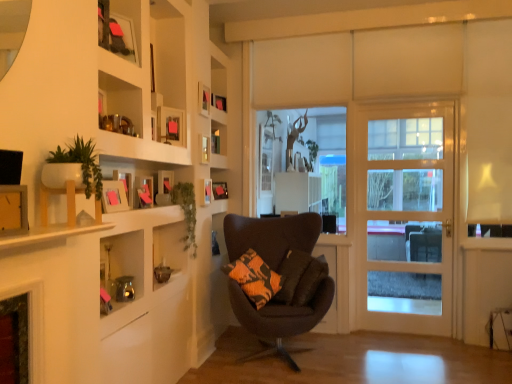
You are a GUI agent. You are given a task and a screenshot of the screen. Output one action in this format:
    pyautogui.click(x=<x>, y=<y>)
    Task: Click on the dark brown leather swivel chair at center
    
    Given the screenshot: What is the action you would take?
    pyautogui.click(x=423, y=242)

What do you see at coordinates (13, 210) in the screenshot? Image resolution: width=512 pixels, height=384 pixels. I see `matte gold picture frame at left, marked as the eighth picture frame in a back-to-front arrangement` at bounding box center [13, 210].

Measure the distance between matte wooden picture frame at upper center, which appears as the 4th picture frame when viewed from the back, and camera.

matte wooden picture frame at upper center, which appears as the 4th picture frame when viewed from the back, and camera are 3.25 meters apart.

What do you see at coordinates (204, 99) in the screenshot?
I see `matte wooden picture frame at upper center, which appears as the 4th picture frame when viewed from the back` at bounding box center [204, 99].

Measure the distance between matte wooden picture frame at upper center, acting as the 3th picture frame starting from the front, and camera.

2.88 meters.

What is the approximate height of matte black picture frame at upper center, placed as the 7th picture frame when sorted from front to back?

It is 5.47 inches.

What do you see at coordinates (114, 196) in the screenshot? The width and height of the screenshot is (512, 384). I see `matte pink picture frame at upper left, which is the seventh picture frame in back-to-front order` at bounding box center [114, 196].

The width and height of the screenshot is (512, 384). What do you see at coordinates (281, 319) in the screenshot?
I see `dark brown fabric chair at center` at bounding box center [281, 319].

I want to click on dark brown leather swivel chair at center, so click(x=423, y=242).

Is matte gold picture frame at left, which is the first picture frame from front to back, placed right next to dark brown leather swivel chair at center?

No, matte gold picture frame at left, which is the first picture frame from front to back, is not touching dark brown leather swivel chair at center.

Considering the sizes of objects matte gold picture frame at left, marked as the eighth picture frame in a back-to-front arrangement, and dark brown leather swivel chair at center in the image provided, who is thinner, matte gold picture frame at left, marked as the eighth picture frame in a back-to-front arrangement, or dark brown leather swivel chair at center?

With smaller width is matte gold picture frame at left, marked as the eighth picture frame in a back-to-front arrangement.

In terms of size, does matte gold picture frame at left, marked as the eighth picture frame in a back-to-front arrangement, appear bigger or smaller than dark brown leather swivel chair at center?

Clearly, matte gold picture frame at left, marked as the eighth picture frame in a back-to-front arrangement, is smaller in size than dark brown leather swivel chair at center.

Is matte gold picture frame at left, which is the first picture frame from front to back, behind dark brown leather swivel chair at center?

No.

How distant is matte black picture frame at upper center, marked as the 1th picture frame in a back-to-front arrangement, from orange-patterned fabric pillow at center?

matte black picture frame at upper center, marked as the 1th picture frame in a back-to-front arrangement, and orange-patterned fabric pillow at center are 1.08 meters apart.

Is matte black picture frame at upper center, marked as the 1th picture frame in a back-to-front arrangement, oriented towards orange-patterned fabric pillow at center?

No, matte black picture frame at upper center, marked as the 1th picture frame in a back-to-front arrangement, is not facing towards orange-patterned fabric pillow at center.

Is matte black picture frame at upper center, the 8th picture frame in the front-to-back sequence, next to orange-patterned fabric pillow at center?

No, matte black picture frame at upper center, the 8th picture frame in the front-to-back sequence, is not touching orange-patterned fabric pillow at center.

Does point (224, 190) appear closer or farther from the camera than point (285, 277)?

Point (224, 190) appears to be farther away from the viewer than point (285, 277).

Which point is more distant from viewer, (395, 274) or (263, 328)?

Point (395, 274)

In terms of size, does light wood door at right appear bigger or smaller than dark brown fabric chair at center?

light wood door at right is smaller than dark brown fabric chair at center.

Can you confirm if light wood door at right is shorter than dark brown fabric chair at center?

No.

From the picture: Choose the correct answer: Is light wood door at right inside dark brown fabric chair at center or outside it?

light wood door at right is not enclosed by dark brown fabric chair at center.

Would you say matte wooden picture frame at upper center, the 6th picture frame viewed from the back, is outside dark brown fabric chair at center?

Indeed, matte wooden picture frame at upper center, the 6th picture frame viewed from the back, is completely outside dark brown fabric chair at center.

In the image, is matte wooden picture frame at upper center, acting as the 3th picture frame starting from the front, positioned in front of or behind dark brown fabric chair at center?

In the image, matte wooden picture frame at upper center, acting as the 3th picture frame starting from the front, appears in front of dark brown fabric chair at center.

From a real-world perspective, which is physically below, matte wooden picture frame at upper center, acting as the 3th picture frame starting from the front, or dark brown fabric chair at center?

In real-world perspective, dark brown fabric chair at center is lower.

Can you tell me how much matte wooden picture frame at upper center, acting as the 3th picture frame starting from the front, and dark brown fabric chair at center differ in facing direction?

There is a 44-degree angle between the facing directions of matte wooden picture frame at upper center, acting as the 3th picture frame starting from the front, and dark brown fabric chair at center.

Measure the distance from matte pink picture frame at upper left, which is the seventh picture frame in back-to-front order, to matte wooden picture frame at upper center, which ranks as the 4th picture frame in front-to-back order.

matte pink picture frame at upper left, which is the seventh picture frame in back-to-front order, and matte wooden picture frame at upper center, which ranks as the 4th picture frame in front-to-back order, are 19.96 inches apart from each other.

Who is more distant, matte pink picture frame at upper left, arranged as the second picture frame when viewed from the front, or matte wooden picture frame at upper center, which ranks as the 4th picture frame in front-to-back order?

matte wooden picture frame at upper center, which ranks as the 4th picture frame in front-to-back order, is behind.

Could you tell me if matte pink picture frame at upper left, arranged as the second picture frame when viewed from the front, is turned towards matte wooden picture frame at upper center, placed as the fifth picture frame when sorted from back to front?

No, matte pink picture frame at upper left, arranged as the second picture frame when viewed from the front, is not oriented towards matte wooden picture frame at upper center, placed as the fifth picture frame when sorted from back to front.

Can matte wooden picture frame at upper center, which ranks as the 4th picture frame in front-to-back order, be found inside matte pink picture frame at upper left, which is the seventh picture frame in back-to-front order?

No, matte wooden picture frame at upper center, which ranks as the 4th picture frame in front-to-back order, is not surrounded by matte pink picture frame at upper left, which is the seventh picture frame in back-to-front order.

Between green leafy plant at upper left and wooden shelves at upper left, which one has larger width?

With larger width is wooden shelves at upper left.

Can you tell me how much green leafy plant at upper left and wooden shelves at upper left differ in facing direction?

0.383 degrees separate the facing orientations of green leafy plant at upper left and wooden shelves at upper left.

Could you tell me if green leafy plant at upper left is turned towards wooden shelves at upper left?

No, green leafy plant at upper left is not oriented towards wooden shelves at upper left.

Considering their positions, is wooden shelves at upper left located in front of or behind dark brown leather swivel chair at center?

Visually, wooden shelves at upper left is located in front of dark brown leather swivel chair at center.

From the image's perspective, who appears lower, wooden shelves at upper left or dark brown leather swivel chair at center?

dark brown leather swivel chair at center.

Which object is positioned more to the left, wooden shelves at upper left or dark brown leather swivel chair at center?

wooden shelves at upper left.

This screenshot has height=384, width=512. In order to click on swivel chair below the matte gold picture frame at left, which is the first picture frame from front to back (from a real-world perspective) in this screenshot , I will do [x=423, y=242].

This screenshot has width=512, height=384. In order to click on pillow in front of the matte black picture frame at upper center, marked as the 1th picture frame in a back-to-front arrangement in this screenshot , I will do `click(300, 277)`.

From the image, which object appears to be nearer to orange-patterned fabric pillow at center, matte wooden picture frame at upper center, which appears as the 4th picture frame when viewed from the back, or matte pink picture frame at upper left, arranged as the second picture frame when viewed from the front?

Based on the image, matte wooden picture frame at upper center, which appears as the 4th picture frame when viewed from the back, appears to be nearer to orange-patterned fabric pillow at center.

Based on their spatial positions, is wooden picture frame at upper center, which is the 3th picture frame in back-to-front order, or matte black picture frame at upper center, acting as the 2th picture frame starting from the back, closer to matte black picture frame at upper center, the 8th picture frame in the front-to-back sequence?

wooden picture frame at upper center, which is the 3th picture frame in back-to-front order, is positioned closer to the anchor matte black picture frame at upper center, the 8th picture frame in the front-to-back sequence.

From the image, which object appears to be farther from matte wooden picture frame at upper center, acting as the 3th picture frame starting from the front, matte black picture frame at upper center, marked as the 1th picture frame in a back-to-front arrangement, or dark brown leather swivel chair at center?

The object further to matte wooden picture frame at upper center, acting as the 3th picture frame starting from the front, is dark brown leather swivel chair at center.

Based on their spatial positions, is dark brown fabric chair at center or white ceramic pot at upper left closer to matte black picture frame at upper center, the 8th picture frame in the front-to-back sequence?

dark brown fabric chair at center is closer to matte black picture frame at upper center, the 8th picture frame in the front-to-back sequence.

When comparing their distances from matte black picture frame at upper center, the 8th picture frame in the front-to-back sequence, does orange-patterned fabric pillow at center or white ceramic pot at upper left seem closer?

orange-patterned fabric pillow at center is closer to matte black picture frame at upper center, the 8th picture frame in the front-to-back sequence.

When comparing their distances from matte wooden picture frame at upper center, acting as the 3th picture frame starting from the front, does matte black picture frame at upper center, placed as the 7th picture frame when sorted from front to back, or light wood door at right seem closer?

matte black picture frame at upper center, placed as the 7th picture frame when sorted from front to back, is positioned closer to the anchor matte wooden picture frame at upper center, acting as the 3th picture frame starting from the front.

Estimate the real-world distances between objects in this image. Which object is closer to white ceramic pot at upper left, matte wooden picture frame at upper center, placed as the fifth picture frame when sorted from back to front, or dark brown leather swivel chair at center?

matte wooden picture frame at upper center, placed as the fifth picture frame when sorted from back to front, is positioned closer to the anchor white ceramic pot at upper left.

When comparing their distances from light wood door at right, does matte black picture frame at upper center, marked as the 1th picture frame in a back-to-front arrangement, or matte wooden picture frame at upper center, which ranks as the 4th picture frame in front-to-back order, seem closer?

matte black picture frame at upper center, marked as the 1th picture frame in a back-to-front arrangement.

Where is `plant that lies between matte wooden picture frame at upper center, which appears as the 4th picture frame when viewed from the back, and dark brown fabric chair at center from top to bottom`? Image resolution: width=512 pixels, height=384 pixels. plant that lies between matte wooden picture frame at upper center, which appears as the 4th picture frame when viewed from the back, and dark brown fabric chair at center from top to bottom is located at coordinates (186, 211).

Locate an element on the screen. pillow between matte gold picture frame at left, marked as the eighth picture frame in a back-to-front arrangement, and wooden picture frame at upper center, which is the 6th picture frame from front to back, in the front-back direction is located at coordinates (300, 277).

This screenshot has width=512, height=384. What are the coordinates of `plant that lies between matte black picture frame at upper center, placed as the 7th picture frame when sorted from front to back, and dark brown fabric chair at center from top to bottom` in the screenshot? It's located at (186, 211).

Identify the location of plant positioned between wooden shelves at upper left and matte black picture frame at upper center, the 8th picture frame in the front-to-back sequence, from near to far. This screenshot has height=384, width=512. (186, 211).